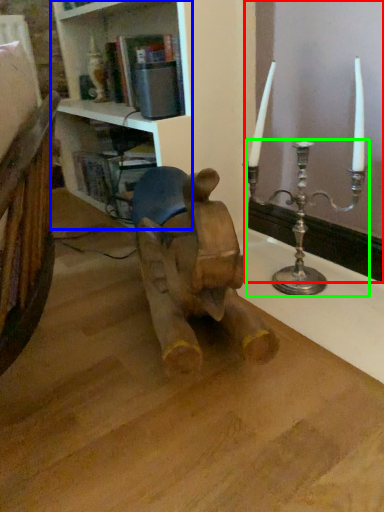
Question: Which object is positioned farthest from window frame (highlighted by a red box)? Select from shelf (highlighted by a blue box) and candle holder (highlighted by a green box).

Choices:
 (A) shelf
 (B) candle holder

Answer: (A)